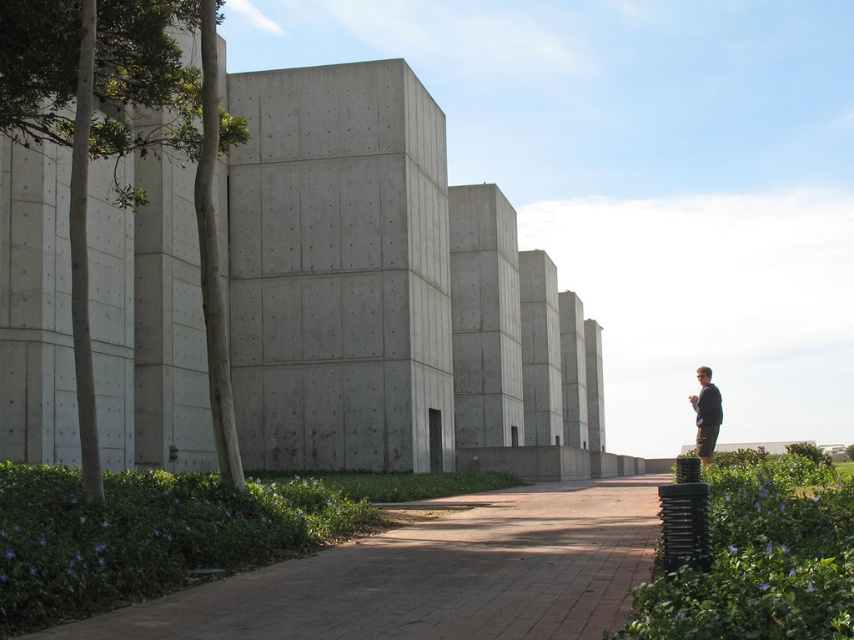
Is brown brick path at center shorter than dark blue sweater at right?

Indeed, brown brick path at center has a lesser height compared to dark blue sweater at right.

Does brown brick path at center appear under dark blue sweater at right?

Yes.

Who is more distant from viewer, (x=581, y=572) or (x=706, y=369)?

The point (x=706, y=369) is behind.

Identify the location of brown brick path at center. The width and height of the screenshot is (854, 640). (431, 576).